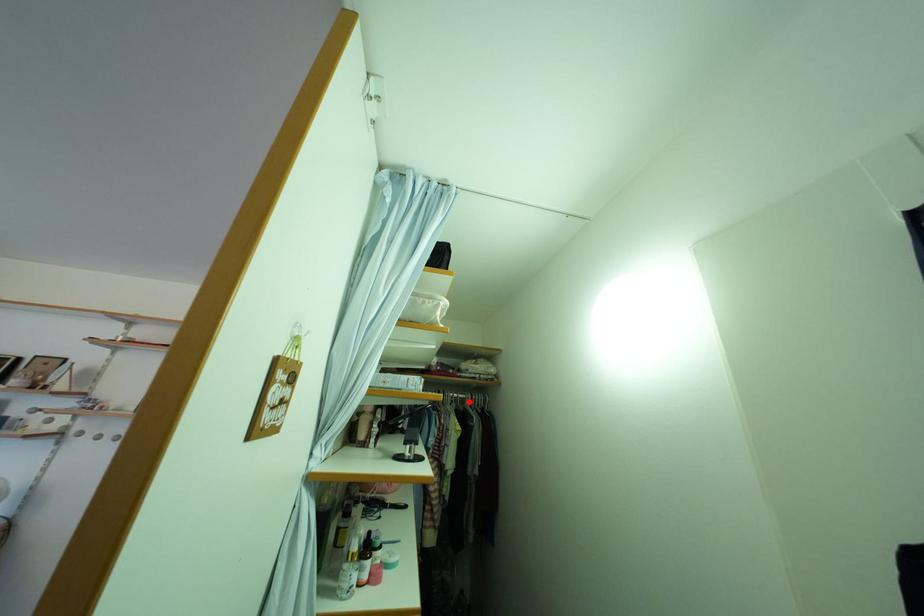
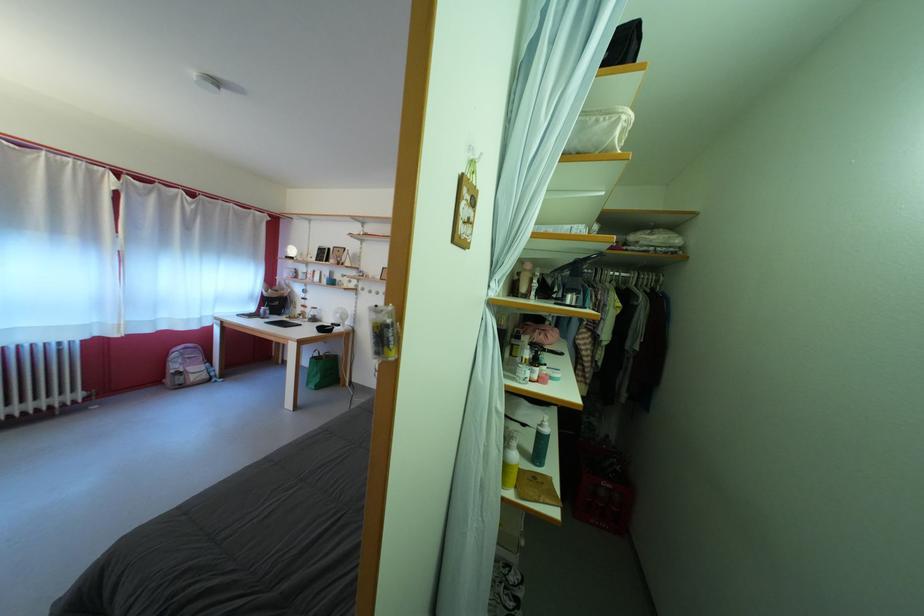
Question: I am providing you with two images of the same scene from different viewpoints. A red point is shown in image1. For the corresponding object point in image2, is it positioned nearer or farther from the camera?

Choices:
 (A) Nearer
 (B) Farther

Answer: (A)